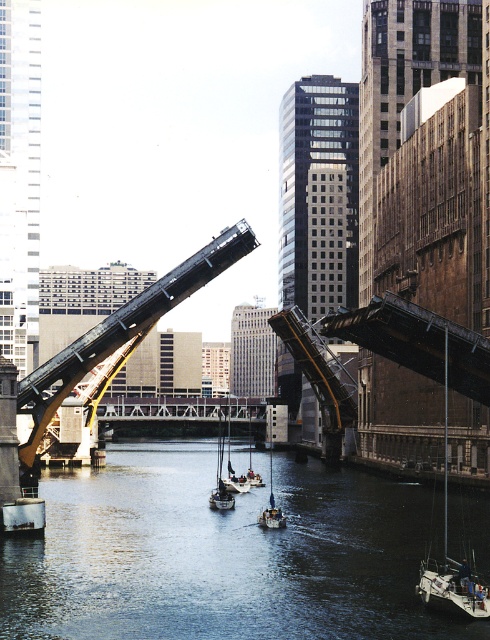
Question: Does dark blue water at center appear over white matte sailboat at lower right?

Choices:
 (A) yes
 (B) no

Answer: (B)

Question: Which of the following is the closest to the observer?

Choices:
 (A) metallic gray boat at center
 (B) white matte sailboat at lower right
 (C) dark blue water at center

Answer: (C)

Question: Which point is farther to the camera?

Choices:
 (A) (103, 637)
 (B) (214, 506)
 (C) (267, 410)
 (D) (431, 604)

Answer: (C)

Question: Which point is closer to the camera?

Choices:
 (A) (219, 422)
 (B) (261, 516)

Answer: (B)

Question: Does white matte sailboat at lower right appear under white wooden sailboat at center?

Choices:
 (A) yes
 (B) no

Answer: (B)

Question: Considering the relative positions of metallic gray boat at center and white wooden sailboat at center in the image provided, where is metallic gray boat at center located with respect to white wooden sailboat at center?

Choices:
 (A) below
 (B) above

Answer: (B)